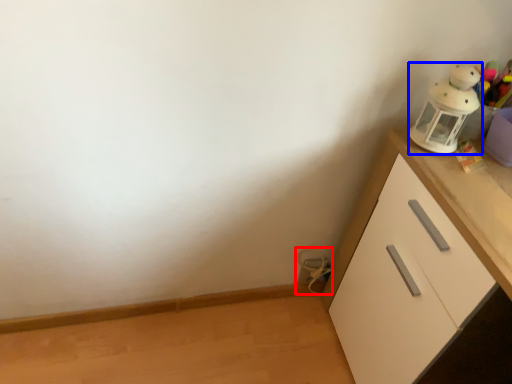
Question: Which object appears closest to the camera in this image, toy (highlighted by a red box) or toy (highlighted by a blue box)?

Choices:
 (A) toy
 (B) toy

Answer: (B)